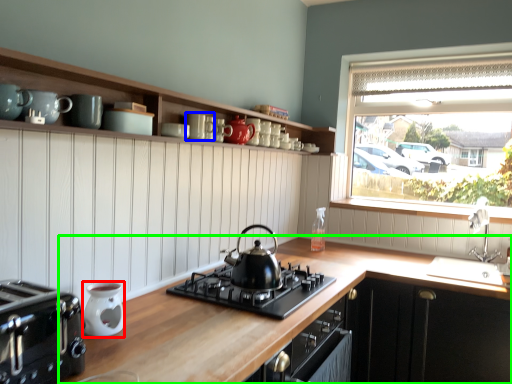
Question: Which object is the farthest from kitchen appliance (highlighted by a red box)? Choose among these: mug (highlighted by a blue box) or countertop (highlighted by a green box).

Choices:
 (A) mug
 (B) countertop

Answer: (A)